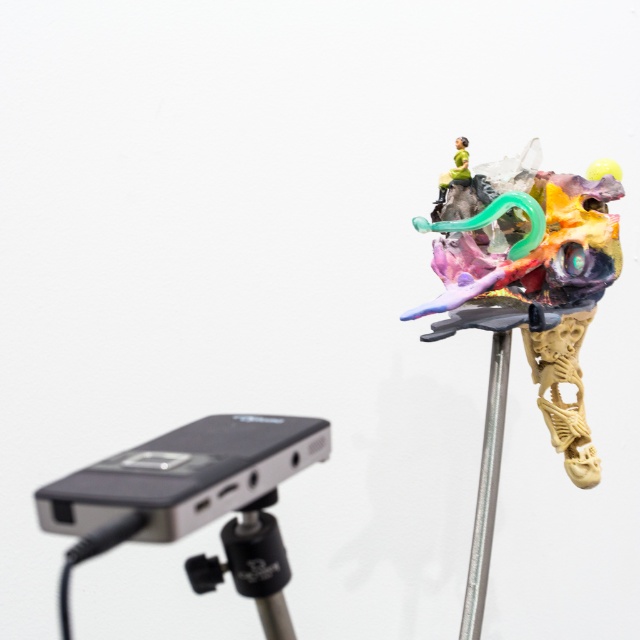
Question: Does multicolored plastic sculpture at upper right have a lesser width compared to metallic silver pole at upper right?

Choices:
 (A) no
 (B) yes

Answer: (A)

Question: Does multicolored plastic sculpture at upper right come behind black plastic device at lower left?

Choices:
 (A) yes
 (B) no

Answer: (A)

Question: Among these points, which one is farthest from the camera?

Choices:
 (A) (493, 493)
 (B) (499, 296)
 (C) (220, 417)
 (D) (252, 595)

Answer: (B)

Question: Which point appears farthest from the camera in this image?

Choices:
 (A) (243, 595)
 (B) (500, 371)

Answer: (B)

Question: Is multicolored plastic sculpture at upper right to the left of metallic silver pole at upper right from the viewer's perspective?

Choices:
 (A) yes
 (B) no

Answer: (B)

Question: Which point appears farthest from the camera in this image?

Choices:
 (A) (243, 566)
 (B) (588, 262)

Answer: (B)